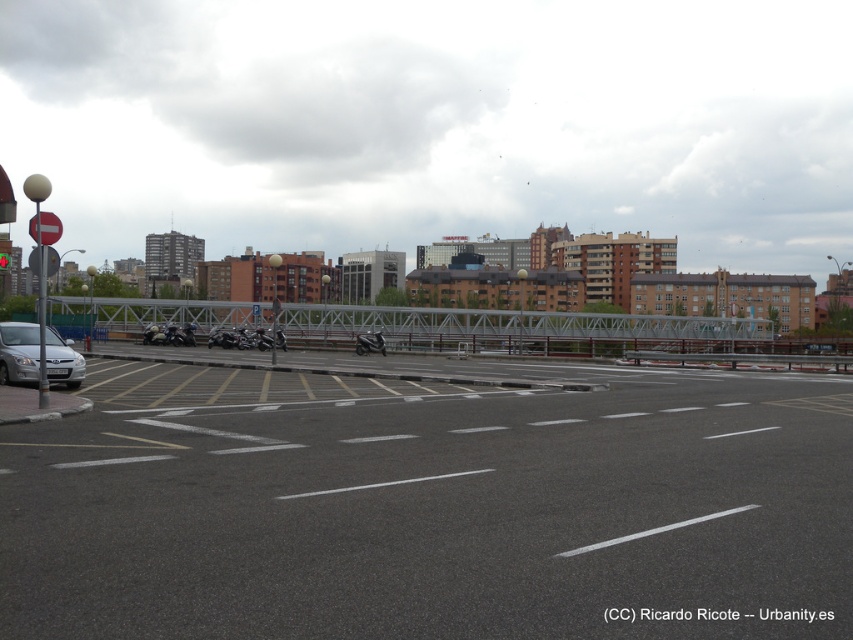
You are a delivery driver who needs to park your silver metallic car at lower left in a parking spot that is 2 meters wide. Can you fit your car into the spot?

The silver metallic car at lower left is located at point (x=19, y=352), but the provided information does not specify the car dimensions or the parking spot size. Therefore, it is impossible to determine if the car will fit into the spot.

In the scene shown: You are a pedestrian standing on the metal pedestrian bridge and want to cross to the shiny black motorcycle at center. Is the silver metallic car at lower left blocking your path?

The silver metallic car at lower left is closer to the viewer than the shiny black motorcycle at center, so it is blocking the path to the shiny black motorcycle at center.

You are a delivery driver who needs to transport a large cargo container that is 2 meters wide. You are currently at the silver metallic car at lower left and want to drive under the metallic gray bridge at center. Can your cargo container fit under the bridge based on its width?

The metallic gray bridge at center is wider than the silver metallic car at lower left. Since the car is 2 meters wide, the bridge is wider than that, so the cargo container can fit under the bridge as long as its width does not exceed the bridge width.